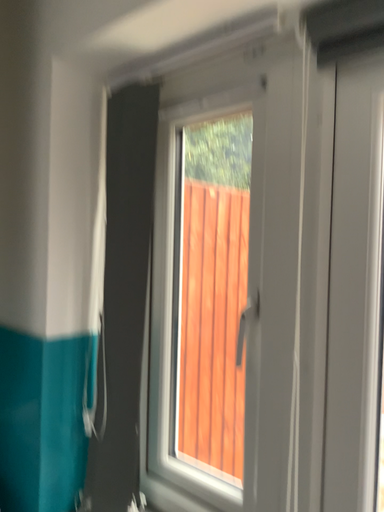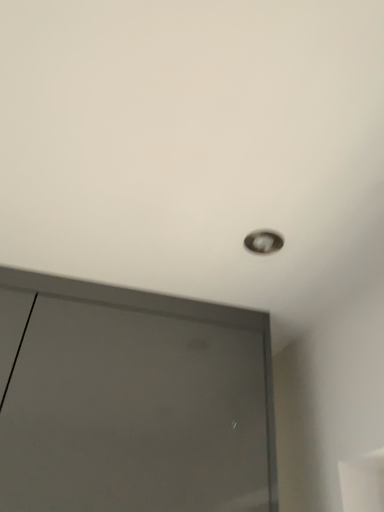
Question: How did the camera likely rotate when shooting the video?

Choices:
 (A) rotated left
 (B) rotated right

Answer: (A)